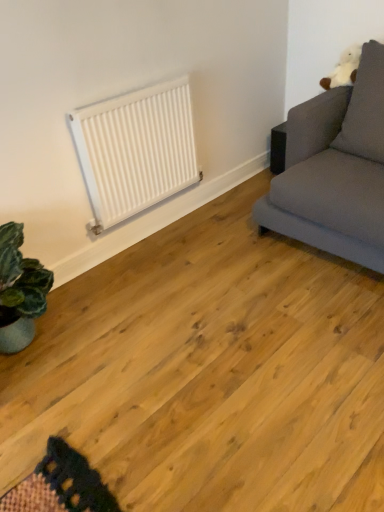
Where is `free region under white matte radiator at upper center (from a real-world perspective)`? The image size is (384, 512). free region under white matte radiator at upper center (from a real-world perspective) is located at coordinates (148, 228).